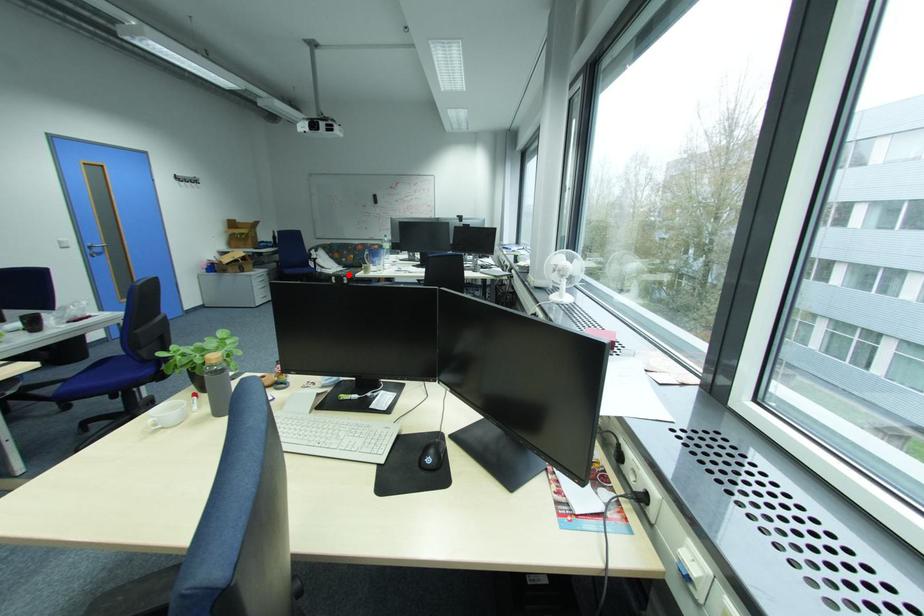
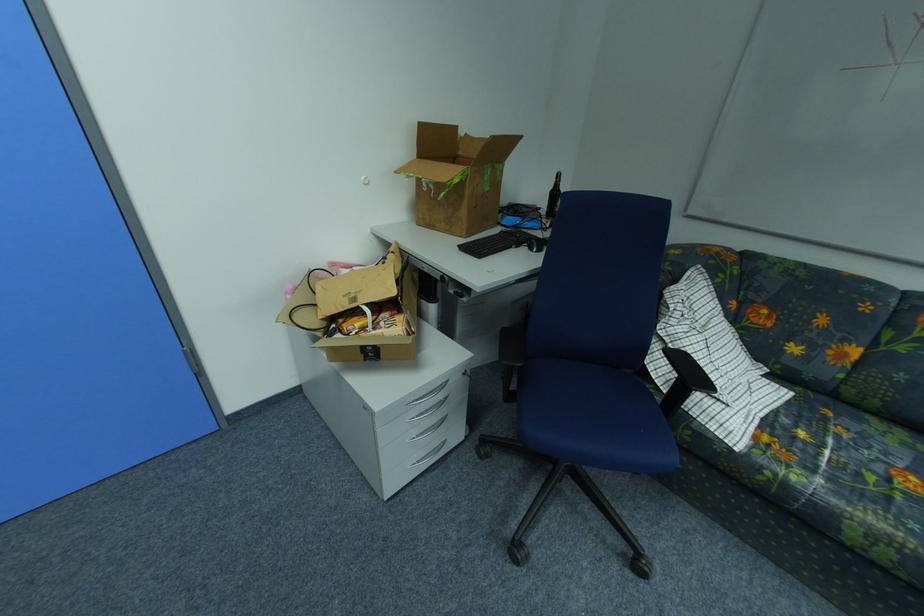
Question: I am providing you with two images of the same scene from different viewpoints. Image1 has a red point marked. In image2, the corresponding 3D location appears at what relative position? Reply with the corresponding letter.

Choices:
 (A) Closer
 (B) Farther

Answer: (A)